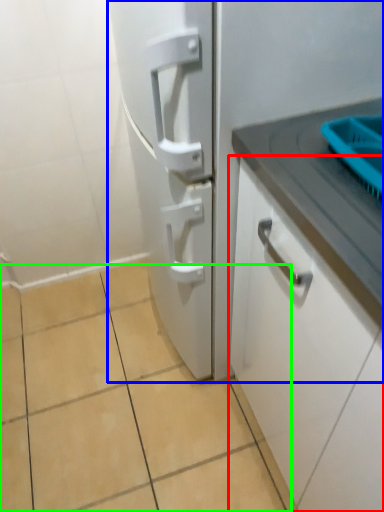
Question: Which object is positioned farthest from cabinetry (highlighted by a red box)? Select from refrigerator (highlighted by a blue box) and ceramic tile (highlighted by a green box).

Choices:
 (A) refrigerator
 (B) ceramic tile

Answer: (B)